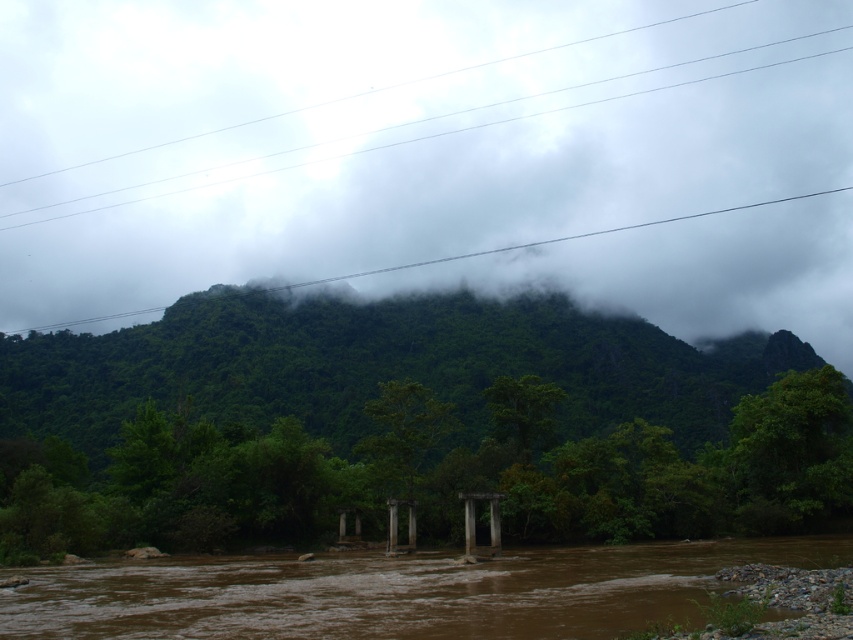
Question: Among these objects, which one is nearest to the camera?

Choices:
 (A) green leafy hillside at upper center
 (B) brown muddy water at center

Answer: (B)

Question: Can you confirm if green leafy hillside at upper center is bigger than brown muddy water at center?

Choices:
 (A) yes
 (B) no

Answer: (A)

Question: Is green leafy hillside at upper center to the right of brown muddy water at center from the viewer's perspective?

Choices:
 (A) yes
 (B) no

Answer: (B)

Question: Which object appears closest to the camera in this image?

Choices:
 (A) brown muddy water at center
 (B) green leafy hillside at upper center

Answer: (A)

Question: Can you confirm if green leafy hillside at upper center is positioned to the left of brown muddy water at center?

Choices:
 (A) no
 (B) yes

Answer: (B)